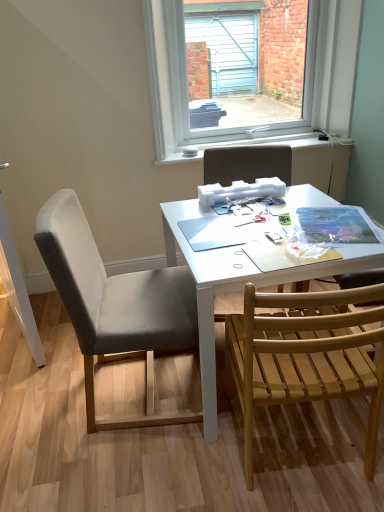
Question: From the image's perspective, is gray fabric chair at center, positioned as the second chair in left-to-right order, on gray fabric chair at left, the third chair viewed from the right?

Choices:
 (A) no
 (B) yes

Answer: (B)

Question: Considering the relative sizes of gray fabric chair at center, positioned as the second chair in left-to-right order, and gray fabric chair at left, acting as the first chair starting from the left, in the image provided, is gray fabric chair at center, positioned as the second chair in left-to-right order, bigger than gray fabric chair at left, acting as the first chair starting from the left,?

Choices:
 (A) no
 (B) yes

Answer: (A)

Question: From a real-world perspective, is gray fabric chair at center, acting as the second chair starting from the right, below gray fabric chair at left, acting as the first chair starting from the left?

Choices:
 (A) no
 (B) yes

Answer: (A)

Question: From a real-world perspective, is gray fabric chair at center, positioned as the second chair in left-to-right order, physically above gray fabric chair at left, acting as the first chair starting from the left?

Choices:
 (A) yes
 (B) no

Answer: (A)

Question: Would you say gray fabric chair at center, acting as the second chair starting from the right, is outside gray fabric chair at left, acting as the first chair starting from the left?

Choices:
 (A) no
 (B) yes

Answer: (B)

Question: Considering the positions of gray fabric chair at center, acting as the second chair starting from the right, and wooden slats chair at lower right, the 1th chair positioned from the right, in the image, is gray fabric chair at center, acting as the second chair starting from the right, bigger or smaller than wooden slats chair at lower right, the 1th chair positioned from the right,?

Choices:
 (A) small
 (B) big

Answer: (A)

Question: Which is correct: gray fabric chair at center, acting as the second chair starting from the right, is inside wooden slats chair at lower right, the 1th chair positioned from the right, or outside of it?

Choices:
 (A) outside
 (B) inside

Answer: (A)

Question: Considering the positions of gray fabric chair at center, acting as the second chair starting from the right, and wooden slats chair at lower right, the 1th chair positioned from the right, in the image, is gray fabric chair at center, acting as the second chair starting from the right, wider or thinner than wooden slats chair at lower right, the 1th chair positioned from the right,?

Choices:
 (A) thin
 (B) wide

Answer: (B)

Question: From a real-world perspective, is gray fabric chair at center, acting as the second chair starting from the right, above or below wooden slats chair at lower right, which ranks as the 3th chair in left-to-right order?

Choices:
 (A) below
 (B) above

Answer: (B)

Question: Considering the positions of point (205, 181) and point (97, 302), is point (205, 181) closer or farther from the camera than point (97, 302)?

Choices:
 (A) closer
 (B) farther

Answer: (B)

Question: Which is correct: gray fabric chair at center, positioned as the second chair in left-to-right order, is inside gray fabric chair at left, acting as the first chair starting from the left, or outside of it?

Choices:
 (A) inside
 (B) outside

Answer: (B)

Question: Would you say gray fabric chair at center, positioned as the second chair in left-to-right order, is to the left or to the right of gray fabric chair at left, acting as the first chair starting from the left, in the picture?

Choices:
 (A) left
 (B) right

Answer: (B)

Question: In terms of size, does gray fabric chair at center, acting as the second chair starting from the right, appear bigger or smaller than gray fabric chair at left, the third chair viewed from the right?

Choices:
 (A) big
 (B) small

Answer: (B)

Question: Is clear glass window at upper center situated inside white matte table at center or outside?

Choices:
 (A) inside
 (B) outside

Answer: (B)

Question: From the image's perspective, is clear glass window at upper center above or below white matte table at center?

Choices:
 (A) above
 (B) below

Answer: (A)